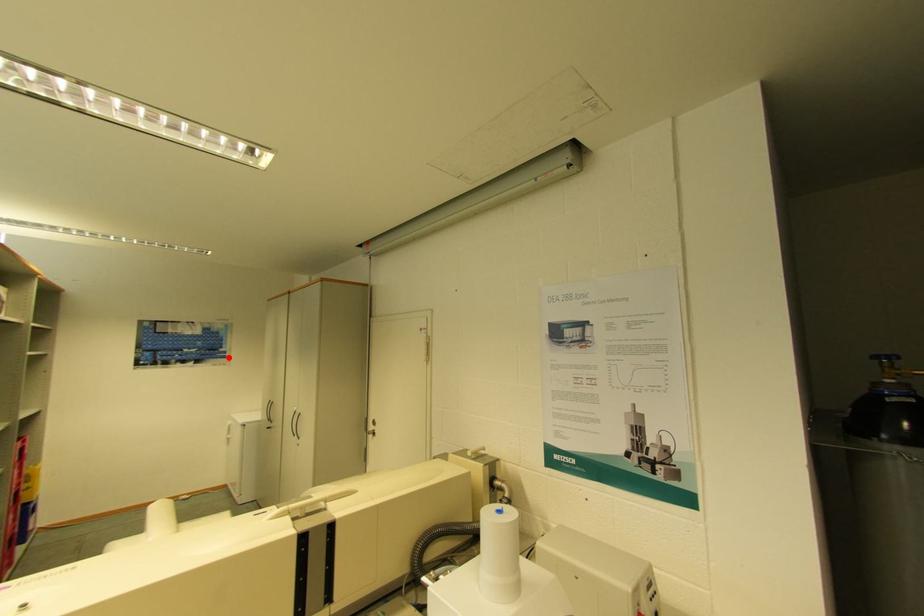
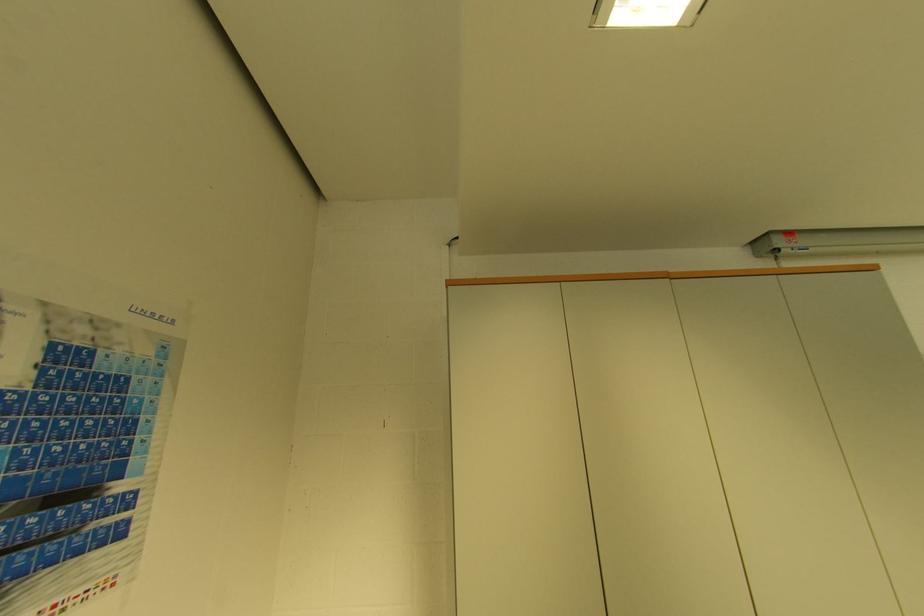
Locate, in the second image, the point that corresponds to the highlighted location in the first image.

(123, 533)